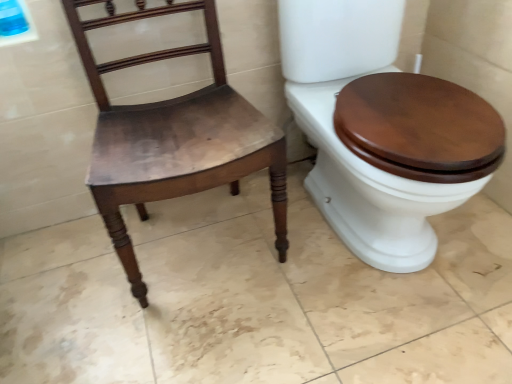
Question: Based on their positions, is matte wood chair at left located to the left or right of wooden toilet seat at right?

Choices:
 (A) right
 (B) left

Answer: (B)

Question: Is matte wood chair at left inside or outside of wooden toilet seat at right?

Choices:
 (A) inside
 (B) outside

Answer: (B)

Question: From the image's perspective, relative to wooden toilet seat at right, is matte wood chair at left above or below?

Choices:
 (A) above
 (B) below

Answer: (B)

Question: Is wooden toilet seat at right wider or thinner than matte wood chair at left?

Choices:
 (A) wide
 (B) thin

Answer: (A)

Question: Would you say wooden toilet seat at right is to the left or to the right of matte wood chair at left in the picture?

Choices:
 (A) right
 (B) left

Answer: (A)

Question: In terms of size, does wooden toilet seat at right appear bigger or smaller than matte wood chair at left?

Choices:
 (A) small
 (B) big

Answer: (B)

Question: From a real-world perspective, is wooden toilet seat at right positioned above or below matte wood chair at left?

Choices:
 (A) below
 (B) above

Answer: (A)